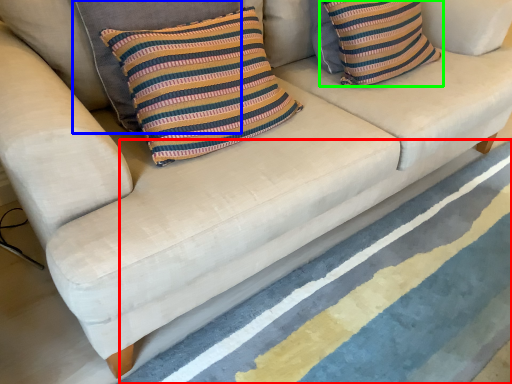
Question: Considering the real-world distances, which object is farthest from stripe (highlighted by a red box)? pillow (highlighted by a blue box) or pillow (highlighted by a green box)?

Choices:
 (A) pillow
 (B) pillow

Answer: (A)